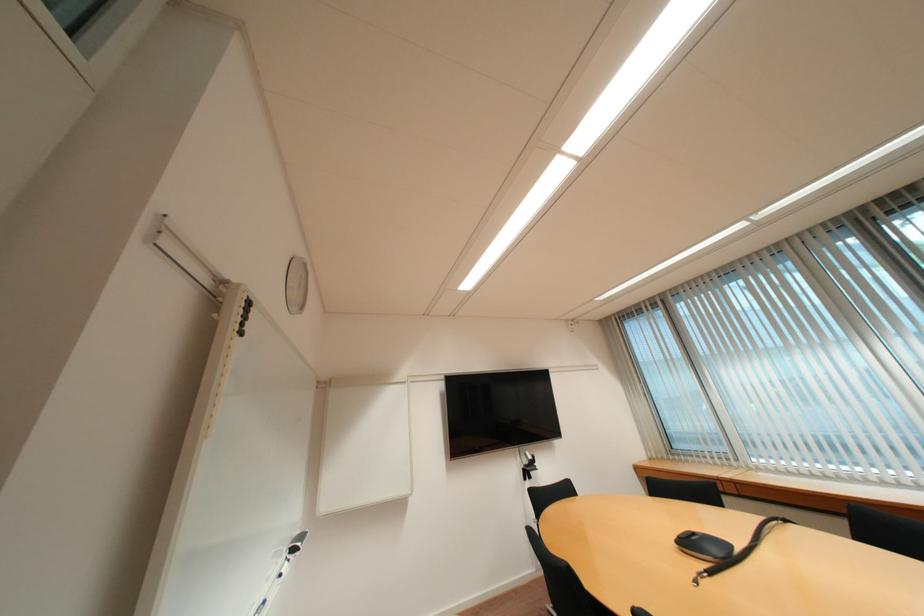
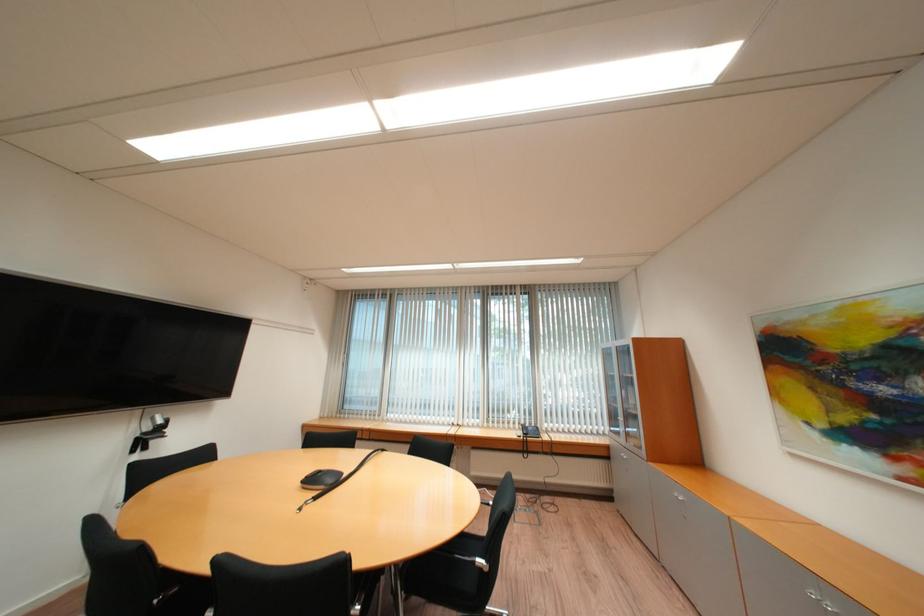
Question: The camera is either moving clockwise (left) or counter-clockwise (right) around the object. The first image is from the beginning of the video and the second image is from the end. Is the camera moving left or right when shooting the video?

Choices:
 (A) Left
 (B) Right

Answer: (A)